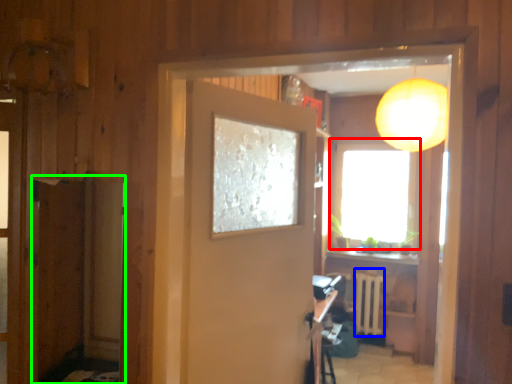
Question: Which object is the farthest from window (highlighted by a red box)? Choose among these: radiator (highlighted by a blue box) or screen door (highlighted by a green box).

Choices:
 (A) radiator
 (B) screen door

Answer: (B)